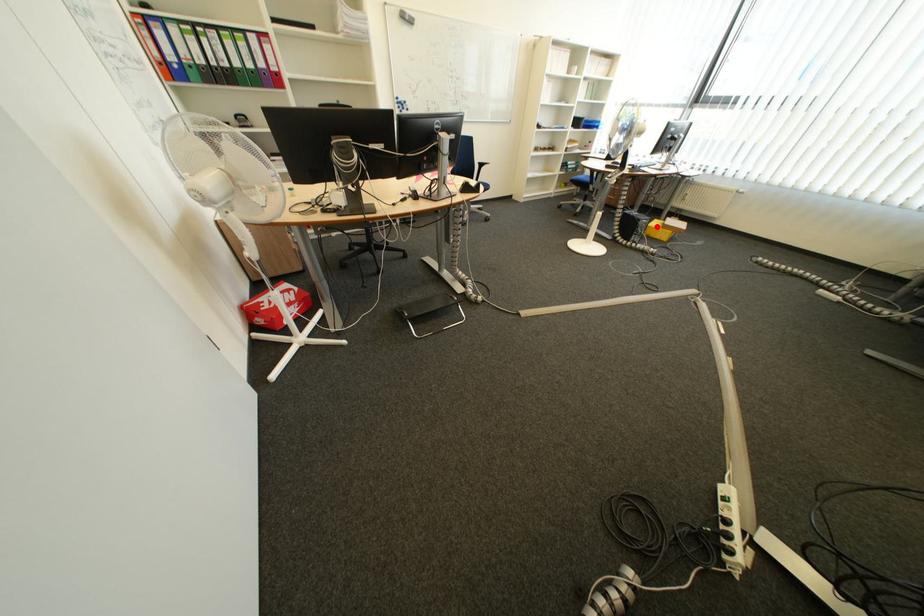
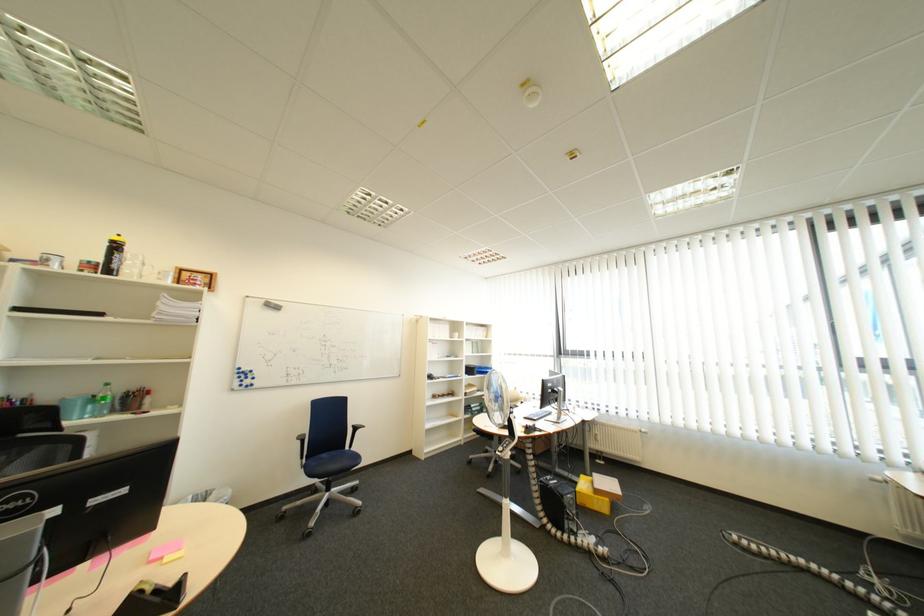
The point at the highlighted location is marked in the first image. Where is the corresponding point in the second image?

(585, 503)